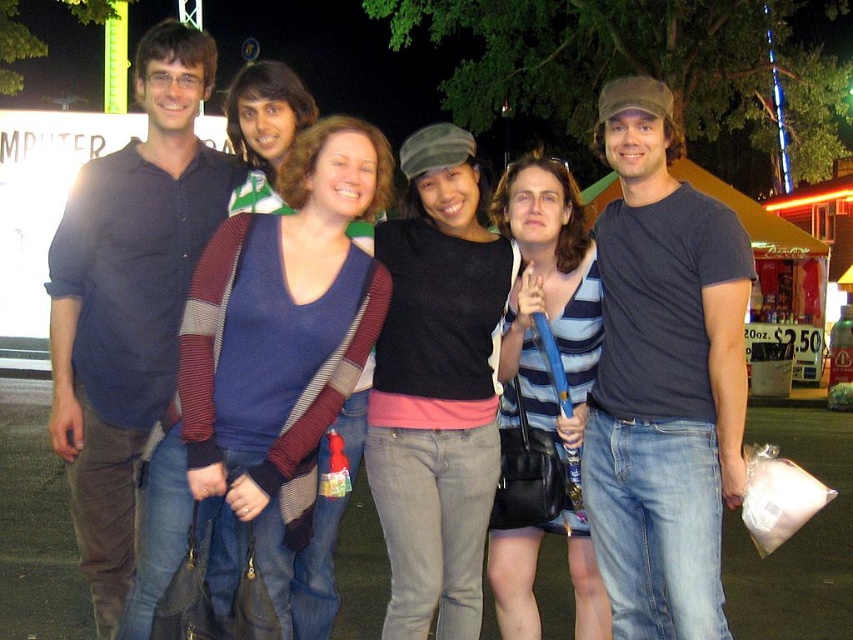
Question: Does dark blue t-shirt at center lie behind matte black sweater at center?

Choices:
 (A) yes
 (B) no

Answer: (B)

Question: Which of these objects is positioned closest to the matte black sweater at center?

Choices:
 (A) dark blue t-shirt at center
 (B) dark blue shirt at left

Answer: (A)

Question: Is dark blue t-shirt at center wider than dark blue shirt at left?

Choices:
 (A) yes
 (B) no

Answer: (A)

Question: Is dark blue shirt at left to the left of matte black sweater at center from the viewer's perspective?

Choices:
 (A) yes
 (B) no

Answer: (A)

Question: Which object is closer to the camera taking this photo?

Choices:
 (A) dark blue shirt at left
 (B) dark blue t-shirt at center
 (C) matte black sweater at center

Answer: (B)

Question: Which of the following is the closest to the observer?

Choices:
 (A) dark blue shirt at left
 (B) dark blue t-shirt at center

Answer: (B)